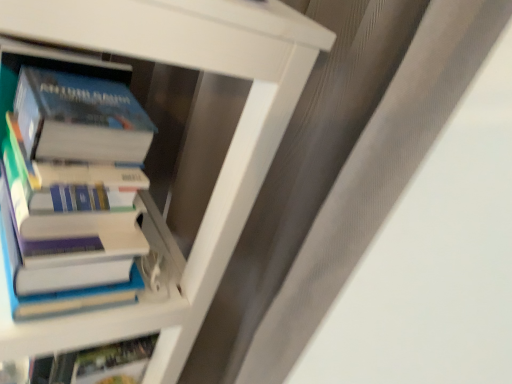
This screenshot has width=512, height=384. In order to click on empty space that is ontop of hardcover books at left, which is the 1th book in top-to-bottom order (from a real-world perspective) in this screenshot , I will do click(69, 89).